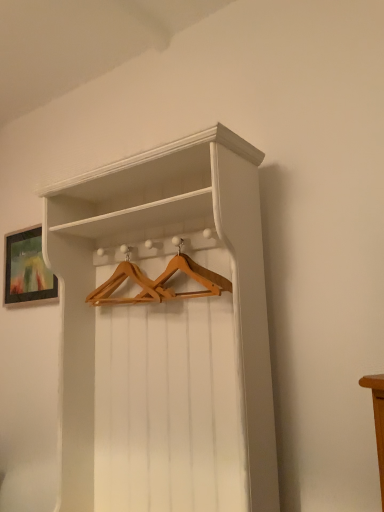
Question: Can we say white wood shelf at center lies outside matte black picture frame at upper left?

Choices:
 (A) yes
 (B) no

Answer: (A)

Question: From a real-world perspective, is white wood shelf at center physically above matte black picture frame at upper left?

Choices:
 (A) yes
 (B) no

Answer: (B)

Question: Can you confirm if white wood shelf at center is positioned to the left of matte black picture frame at upper left?

Choices:
 (A) no
 (B) yes

Answer: (A)

Question: Can you confirm if white wood shelf at center is smaller than matte black picture frame at upper left?

Choices:
 (A) yes
 (B) no

Answer: (B)

Question: Does white wood shelf at center touch matte black picture frame at upper left?

Choices:
 (A) yes
 (B) no

Answer: (B)

Question: Would you say wooden hanger at center is to the left or to the right of matte black picture frame at upper left in the picture?

Choices:
 (A) left
 (B) right

Answer: (B)

Question: Looking at their shapes, would you say wooden hanger at center is wider or thinner than matte black picture frame at upper left?

Choices:
 (A) thin
 (B) wide

Answer: (B)

Question: Does point pos(168,296) appear closer or farther from the camera than point pos(41,264)?

Choices:
 (A) farther
 (B) closer

Answer: (B)

Question: Considering their positions, is wooden hanger at center located in front of or behind matte black picture frame at upper left?

Choices:
 (A) behind
 (B) front

Answer: (B)

Question: Is white wood shelf at center taller or shorter than matte black picture frame at upper left?

Choices:
 (A) short
 (B) tall

Answer: (B)

Question: Visually, is white wood shelf at center positioned to the left or to the right of matte black picture frame at upper left?

Choices:
 (A) left
 (B) right

Answer: (B)

Question: Considering their positions, is white wood shelf at center located in front of or behind matte black picture frame at upper left?

Choices:
 (A) behind
 (B) front

Answer: (B)

Question: Looking at the image, does white wood shelf at center seem bigger or smaller compared to matte black picture frame at upper left?

Choices:
 (A) small
 (B) big

Answer: (B)

Question: In the image, is matte black picture frame at upper left positioned in front of or behind white wood shelf at center?

Choices:
 (A) behind
 (B) front

Answer: (A)

Question: Visually, is matte black picture frame at upper left positioned to the left or to the right of white wood shelf at center?

Choices:
 (A) right
 (B) left

Answer: (B)